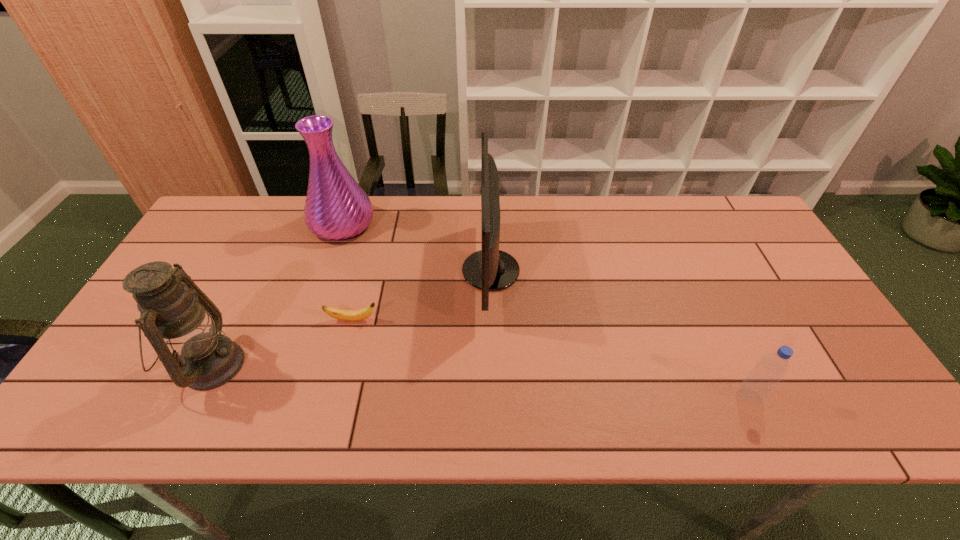
Where is `vase`? This screenshot has width=960, height=540. vase is located at coordinates [336, 208].

Identify the location of monitor. (490, 269).

Find the location of a particular element. The height and width of the screenshot is (540, 960). oil lamp is located at coordinates (175, 314).

Where is `the rightmost object`? Image resolution: width=960 pixels, height=540 pixels. the rightmost object is located at coordinates (769, 371).

At what (x,y) coordinates should I click in order to perform the action: click on the fourth tallest object. Please return your answer as a coordinate pair (x, y). The height and width of the screenshot is (540, 960). Looking at the image, I should click on (769, 371).

Image resolution: width=960 pixels, height=540 pixels. In order to click on the shortest object in this screenshot , I will do `click(346, 315)`.

Identify the location of vacant region located 0.060m on the right of the vase. Image resolution: width=960 pixels, height=540 pixels. (394, 224).

I want to click on vacant area situated 0.090m on the screen side of the second object from right to left, so click(x=431, y=271).

The width and height of the screenshot is (960, 540). Find the location of `vacant space located on the screen side of the second object from right to left`. vacant space located on the screen side of the second object from right to left is located at coordinates (341, 271).

Identify the location of vacant position located on the screen side of the second object from right to left. point(431,271).